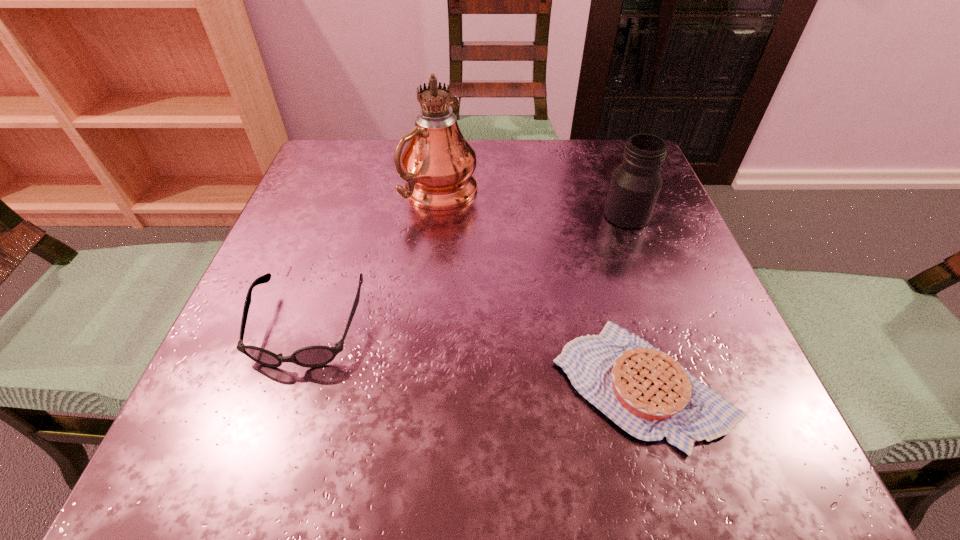
Locate an element on the screen. The image size is (960, 540). object at the far edge is located at coordinates (438, 163).

Where is `object positioned at the near edge`? object positioned at the near edge is located at coordinates coord(647,393).

The width and height of the screenshot is (960, 540). In order to click on object that is at the left edge in this screenshot , I will do `click(312, 356)`.

Find the location of a particular element. The width and height of the screenshot is (960, 540). jar that is at the right edge is located at coordinates (636, 183).

Find the location of a particular element. The width and height of the screenshot is (960, 540). pie located at the right edge is located at coordinates (647, 393).

Image resolution: width=960 pixels, height=540 pixels. Identify the location of object located at the near right corner. (647, 393).

At what (x,y) coordinates should I click in order to perform the action: click on free space at the far edge of the desktop. Please return your answer as a coordinate pair (x, y). The width and height of the screenshot is (960, 540). Looking at the image, I should click on (576, 192).

Where is `blank space at the near edge`? The width and height of the screenshot is (960, 540). blank space at the near edge is located at coordinates (519, 450).

Find the location of `vacant region at the left edge of the desktop`. vacant region at the left edge of the desktop is located at coordinates (339, 254).

Identify the location of vacant space at the right edge. (643, 308).